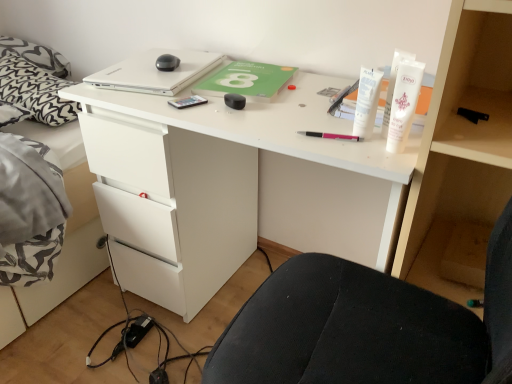
At what (x,y) coordinates should I click in order to perform the action: click on vacant area that lies between pink plastic pen at center, the 3th stationery viewed from the left, and black rubberized mouse at center, the 3th stationery in the front-to-back sequence. Please return your answer as a coordinate pair (x, y). The height and width of the screenshot is (384, 512). Looking at the image, I should click on (282, 119).